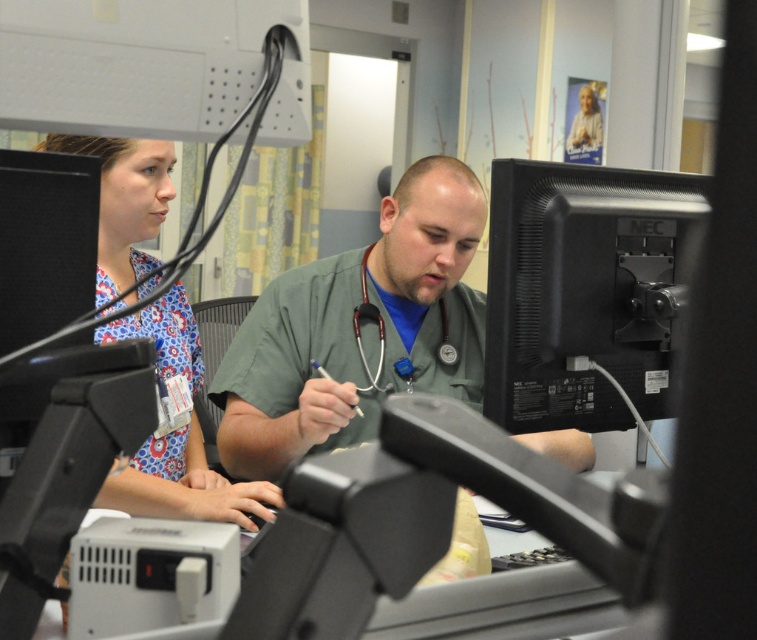
You are a healthcare worker entering the room and need to access the computer. Which object, the black matte computer monitor at center right or the wooden stethoscope at center, would you interact with first based on their positions?

The black matte computer monitor at center right is in front of the wooden stethoscope at center, so you would interact with the black matte computer monitor at center right first as it is closer to you.

You are a healthcare professional who needs to adjust the height of your equipment. You have a black matte computer monitor at center right and a wooden stethoscope at center. Which of these two items is taller?

The black matte computer monitor at center right is much taller than the wooden stethoscope at center according to the description.